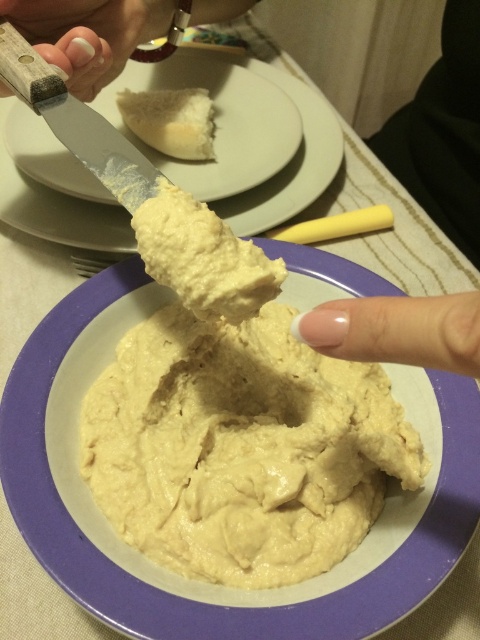
Question: Which point is farther to the camera?

Choices:
 (A) (380, 298)
 (B) (142, 616)

Answer: (B)

Question: Which point is closer to the camera?

Choices:
 (A) nail polish at upper left
 (B) wooden-handled knife at upper left
 (C) creamy beige hummus at center

Answer: (C)

Question: Which point is farther from the camera taking this photo?

Choices:
 (A) (342, 356)
 (B) (44, 280)
 (C) (16, 17)

Answer: (B)

Question: Is wooden-handled knife at upper left positioned before wooden handle knife at upper left?

Choices:
 (A) yes
 (B) no

Answer: (B)

Question: Can you confirm if wooden handle knife at upper left is positioned to the left of nail polish at upper left?

Choices:
 (A) yes
 (B) no

Answer: (B)

Question: Can you confirm if white polished nail at center is positioned to the left of white crumbly biscuit at upper center?

Choices:
 (A) no
 (B) yes

Answer: (A)